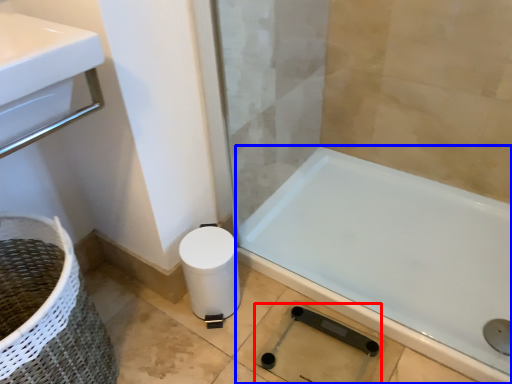
Question: Which point is further to the camera, shower (highlighted by a red box) or bathtub (highlighted by a blue box)?

Choices:
 (A) shower
 (B) bathtub

Answer: (A)